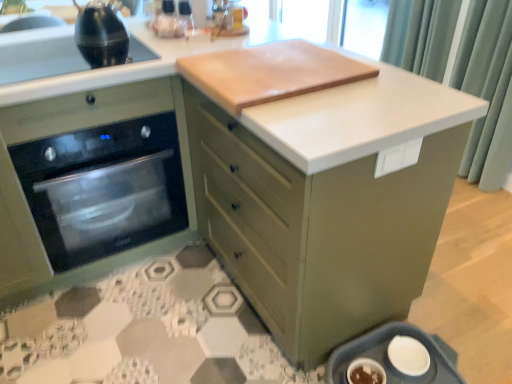
Question: Is black glass oven at left bigger or smaller than black glass sink at upper left?

Choices:
 (A) big
 (B) small

Answer: (A)

Question: Looking at their shapes, would you say black glass oven at left is wider or thinner than black glass sink at upper left?

Choices:
 (A) wide
 (B) thin

Answer: (A)

Question: Estimate the real-world distances between objects in this image. Which object is closer to the matte green cabinet at center?

Choices:
 (A) shiny black kettle at upper left
 (B) light brown wood cutting board at upper center
 (C) black glass oven at left
 (D) matte green trash can at lower right
 (E) black glass sink at upper left

Answer: (B)

Question: Estimate the real-world distances between objects in this image. Which object is farther from the black glass sink at upper left?

Choices:
 (A) green fabric curtain at upper right
 (B) shiny black kettle at upper left
 (C) matte green cabinet at center
 (D) light brown wood cutting board at upper center
 (E) matte green trash can at lower right

Answer: (A)